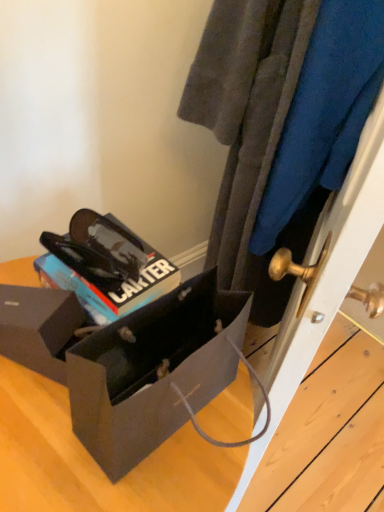
Question: Does velvety blue sweater at center have a greater height compared to glossy black sunglasses at center?

Choices:
 (A) no
 (B) yes

Answer: (B)

Question: From a real-world perspective, is velvety blue sweater at center beneath glossy black sunglasses at center?

Choices:
 (A) yes
 (B) no

Answer: (B)

Question: Is glossy black sunglasses at center at the back of velvety blue sweater at center?

Choices:
 (A) no
 (B) yes

Answer: (A)

Question: From the image's perspective, is velvety blue sweater at center beneath glossy black sunglasses at center?

Choices:
 (A) no
 (B) yes

Answer: (A)

Question: Is velvety blue sweater at center closer to the viewer compared to glossy black sunglasses at center?

Choices:
 (A) no
 (B) yes

Answer: (B)

Question: Looking at their shapes, would you say velvety blue sweater at center is wider or thinner than matte black box at lower left, positioned as the 2th box in front-to-back order?

Choices:
 (A) wide
 (B) thin

Answer: (A)

Question: From the image's perspective, is velvety blue sweater at center located above or below matte black box at lower left, which is counted as the first box, starting from the back?

Choices:
 (A) above
 (B) below

Answer: (A)

Question: Is velvety blue sweater at center situated inside matte black box at lower left, which is counted as the first box, starting from the back, or outside?

Choices:
 (A) inside
 (B) outside

Answer: (B)

Question: Based on their positions, is velvety blue sweater at center located to the left or right of matte black box at lower left, positioned as the 2th box in front-to-back order?

Choices:
 (A) right
 (B) left

Answer: (A)

Question: Is glossy black sunglasses at center inside or outside of velvety blue sweater at center?

Choices:
 (A) inside
 (B) outside

Answer: (B)

Question: From the image's perspective, is glossy black sunglasses at center located above or below velvety blue sweater at center?

Choices:
 (A) above
 (B) below

Answer: (B)

Question: Does point (99, 283) appear closer or farther from the camera than point (261, 59)?

Choices:
 (A) closer
 (B) farther

Answer: (A)

Question: In terms of height, does glossy black sunglasses at center look taller or shorter compared to velvety blue sweater at center?

Choices:
 (A) short
 (B) tall

Answer: (A)

Question: Considering the positions of matte black box at lower left, positioned as the 2th box in front-to-back order, and velvety blue sweater at center in the image, is matte black box at lower left, positioned as the 2th box in front-to-back order, taller or shorter than velvety blue sweater at center?

Choices:
 (A) short
 (B) tall

Answer: (A)

Question: Relative to velvety blue sweater at center, is matte black box at lower left, which is counted as the first box, starting from the back, in front or behind?

Choices:
 (A) front
 (B) behind

Answer: (B)